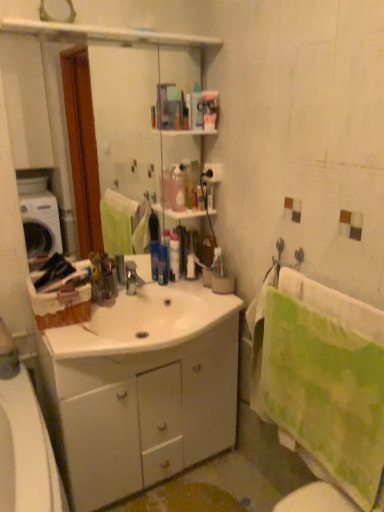
Image resolution: width=384 pixels, height=512 pixels. What are the coordinates of `unoccupied area in front of metallic silver faucet at center` in the screenshot? It's located at (105, 325).